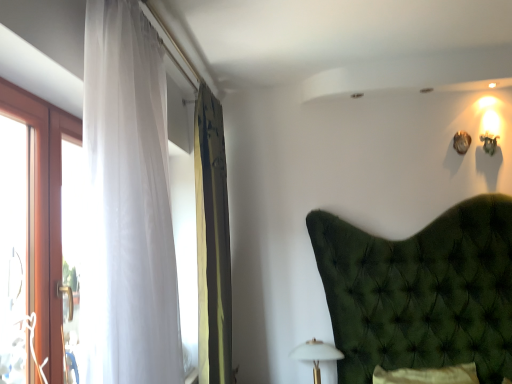
Question: Is white matte table lamp at lower center located outside green textured curtain at left, the second curtain positioned from the front?

Choices:
 (A) no
 (B) yes

Answer: (B)

Question: From the image's perspective, is white matte table lamp at lower center located above green textured curtain at left, arranged as the first curtain when viewed from the back?

Choices:
 (A) yes
 (B) no

Answer: (B)

Question: From a real-world perspective, is white matte table lamp at lower center physically above green textured curtain at left, the second curtain positioned from the front?

Choices:
 (A) no
 (B) yes

Answer: (A)

Question: Is green textured curtain at left, arranged as the first curtain when viewed from the back, inside white matte table lamp at lower center?

Choices:
 (A) yes
 (B) no

Answer: (B)

Question: Is white matte table lamp at lower center thinner than green textured curtain at left, the second curtain positioned from the front?

Choices:
 (A) no
 (B) yes

Answer: (B)

Question: Looking at their shapes, would you say green textured curtain at left, the second curtain positioned from the front, is wider or thinner than translucent white curtain at left, the 2th curtain from the back?

Choices:
 (A) thin
 (B) wide

Answer: (A)

Question: In terms of height, does green textured curtain at left, the second curtain positioned from the front, look taller or shorter compared to translucent white curtain at left, the 2th curtain from the back?

Choices:
 (A) short
 (B) tall

Answer: (B)

Question: From the image's perspective, is green textured curtain at left, the second curtain positioned from the front, located above or below translucent white curtain at left, the first curtain when ordered from front to back?

Choices:
 (A) above
 (B) below

Answer: (B)

Question: Is point (205, 273) closer or farther from the camera than point (120, 289)?

Choices:
 (A) closer
 (B) farther

Answer: (B)

Question: In terms of width, does green textured curtain at left, arranged as the first curtain when viewed from the back, look wider or thinner when compared to white matte table lamp at lower center?

Choices:
 (A) thin
 (B) wide

Answer: (B)

Question: Does point (205, 140) appear closer or farther from the camera than point (320, 349)?

Choices:
 (A) closer
 (B) farther

Answer: (A)

Question: Is green textured curtain at left, the second curtain positioned from the front, spatially inside white matte table lamp at lower center, or outside of it?

Choices:
 (A) inside
 (B) outside

Answer: (B)

Question: Looking at the image, does green textured curtain at left, the second curtain positioned from the front, seem bigger or smaller compared to white matte table lamp at lower center?

Choices:
 (A) big
 (B) small

Answer: (A)

Question: Does point (336, 352) appear closer or farther from the camera than point (224, 306)?

Choices:
 (A) farther
 (B) closer

Answer: (A)

Question: From a real-world perspective, is white matte table lamp at lower center above or below green textured curtain at left, arranged as the first curtain when viewed from the back?

Choices:
 (A) above
 (B) below

Answer: (B)